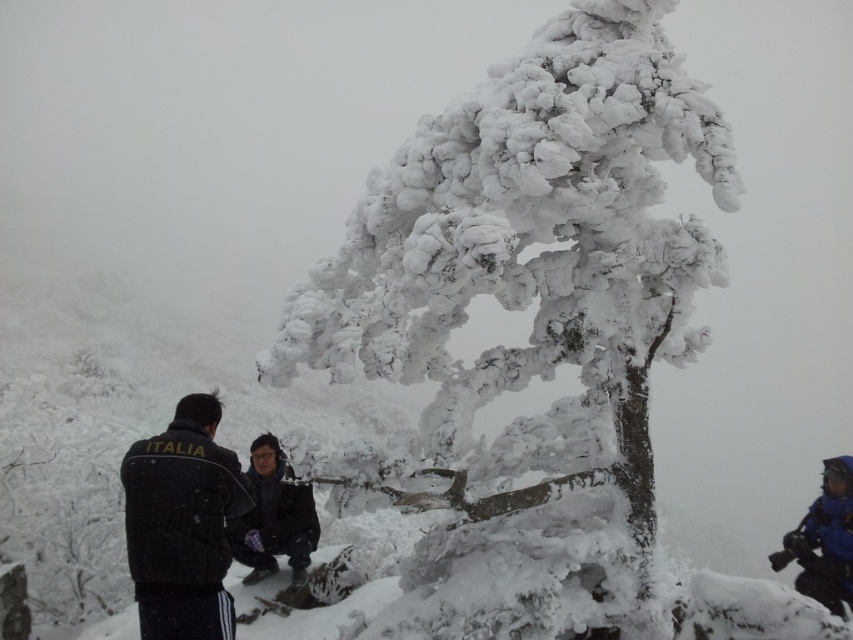
You are standing in the winter scene and want to take a photo of the dark gray fabric jacket at center without the white frosty tree at center blocking it. How can you adjust your position to achieve this?

Move backward to position yourself further away from the white frosty tree at center so that it no longer blocks the view of the dark gray fabric jacket at center.

You are standing at the base of the snow tree and want to hand a scarf to both the dark gray fabric jacket at center and the blue waterproof jacket at lower right. Which person should you approach first to ensure the scarf reaches them without needing to move the scarf between them?

You should approach the dark gray fabric jacket at center first because it is closer to you than the blue waterproof jacket at lower right, so you can give the scarf directly without needing to move it further.

You are standing in the winter scene and want to take a photo of the white frosty tree at center. However, the black fabric jacket at left is blocking your view. How can you adjust your position to capture the tree without obstruction?

The white frosty tree at center is above the black fabric jacket at left, so you can move your position to look upward or move to the side to avoid the jacket blocking the view.